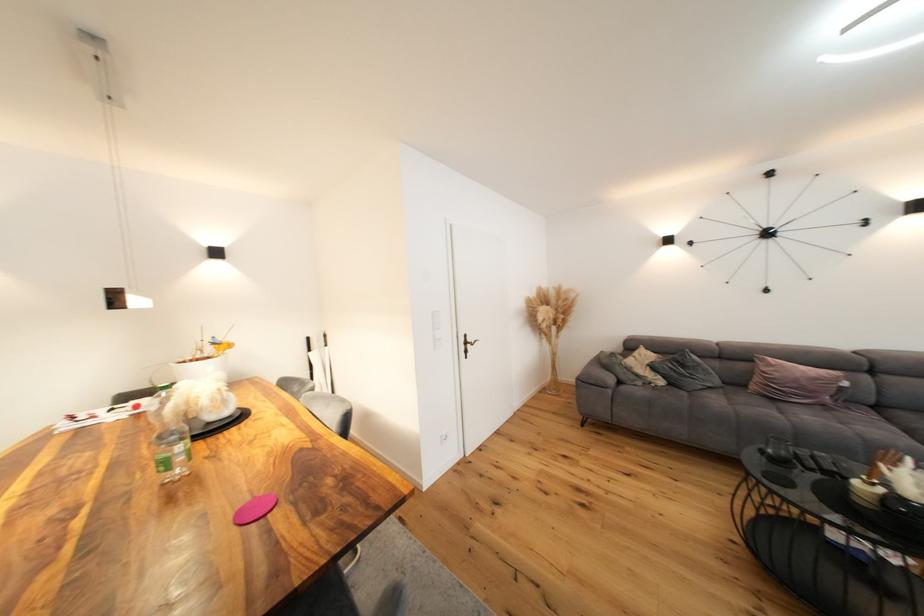
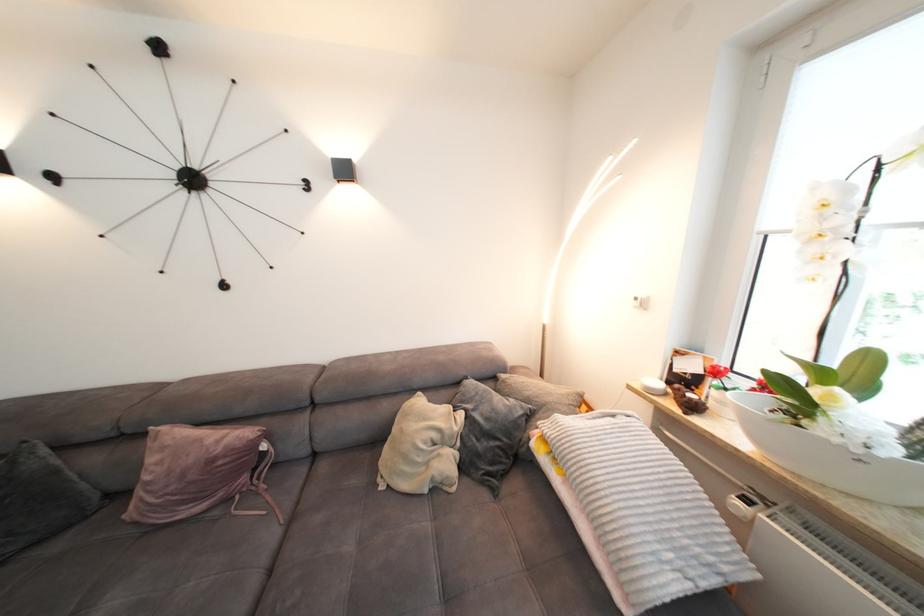
Where in the second image is the point corresponding to [777,367] from the first image?

(171, 448)